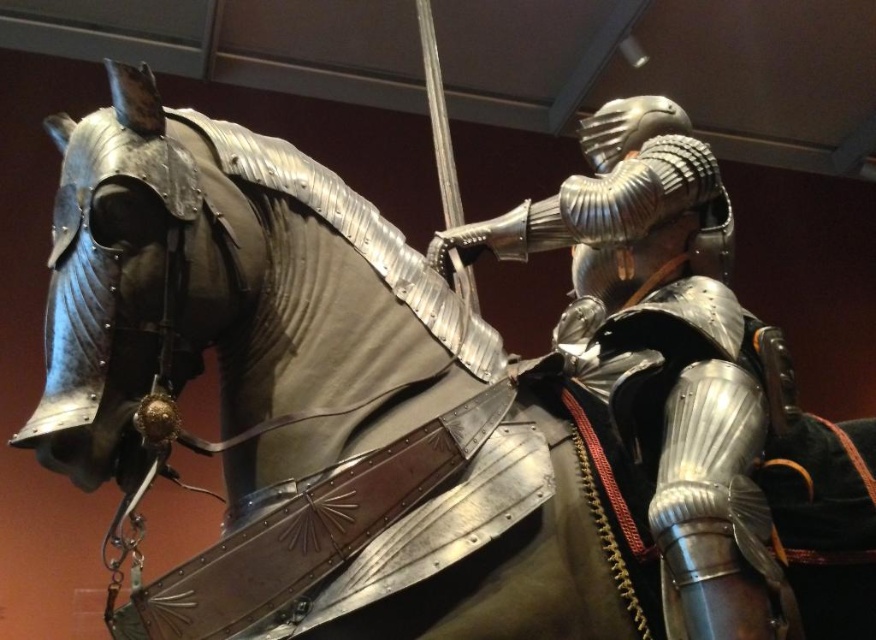
Is shiny silver armor at center below metallic/textured helmet at upper center?

Yes.

Who is more forward, (697, 256) or (661, 108)?

Point (697, 256) is more forward.

This screenshot has height=640, width=876. Identify the location of shiny silver armor at center. coord(668,369).